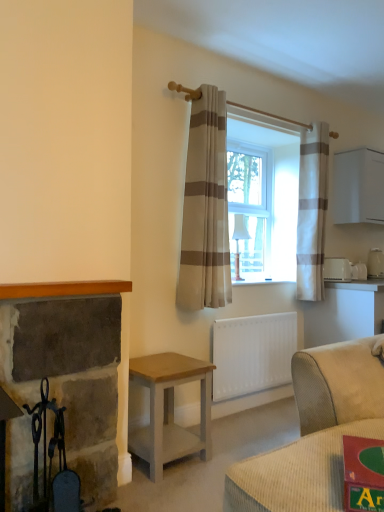
Question: From a real-world perspective, is white plastic toaster at right, which is the 1th appliance in back-to-front order, positioned over white matte radiator at lower center based on gravity?

Choices:
 (A) yes
 (B) no

Answer: (A)

Question: Does white plastic toaster at right, positioned as the third appliance in left-to-right order, turn towards white matte radiator at lower center?

Choices:
 (A) no
 (B) yes

Answer: (A)

Question: Is white plastic toaster at right, placed as the 3th appliance when sorted from front to back, at the right side of white matte radiator at lower center?

Choices:
 (A) no
 (B) yes

Answer: (B)

Question: Is white plastic toaster at right, placed as the 3th appliance when sorted from front to back, oriented away from white matte radiator at lower center?

Choices:
 (A) no
 (B) yes

Answer: (A)

Question: Considering the relative sizes of white plastic toaster at right, positioned as the third appliance in left-to-right order, and white matte radiator at lower center in the image provided, is white plastic toaster at right, positioned as the third appliance in left-to-right order, thinner than white matte radiator at lower center?

Choices:
 (A) yes
 (B) no

Answer: (B)

Question: Does white plastic toaster at right, positioned as the third appliance in left-to-right order, have a smaller size compared to white matte radiator at lower center?

Choices:
 (A) yes
 (B) no

Answer: (A)

Question: From a real-world perspective, is black wrought iron fireplace tools at left positioned under white glossy toaster at upper right, which is the second appliance from front to back, based on gravity?

Choices:
 (A) yes
 (B) no

Answer: (A)

Question: Can you confirm if black wrought iron fireplace tools at left is shorter than white glossy toaster at upper right, which is the second appliance from front to back?

Choices:
 (A) no
 (B) yes

Answer: (A)

Question: Is black wrought iron fireplace tools at left in contact with white glossy toaster at upper right, acting as the second appliance starting from the left?

Choices:
 (A) no
 (B) yes

Answer: (A)

Question: Is black wrought iron fireplace tools at left to the right of white glossy toaster at upper right, which is the second appliance from front to back, from the viewer's perspective?

Choices:
 (A) no
 (B) yes

Answer: (A)

Question: From the image's perspective, would you say black wrought iron fireplace tools at left is positioned over white glossy toaster at upper right, marked as the second appliance in a back-to-front arrangement?

Choices:
 (A) no
 (B) yes

Answer: (A)

Question: From the image's perspective, would you say black wrought iron fireplace tools at left is shown under white glossy toaster at upper right, which is the second appliance from front to back?

Choices:
 (A) no
 (B) yes

Answer: (B)

Question: Does beige striped curtain at center, positioned as the second curtain in right-to-left order, have a greater height compared to light brown wood table at lower center?

Choices:
 (A) yes
 (B) no

Answer: (A)